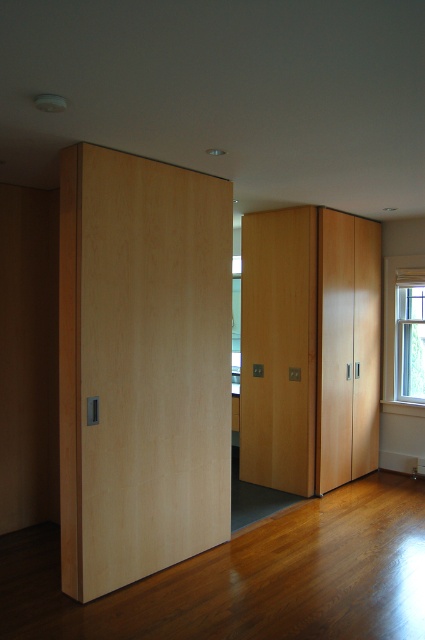
You are moving a 30 inch wide painting and want to hang it between the matte wood cabinet at center and the clear glass window at right. Is there enough space?

The distance between the matte wood cabinet at center and the clear glass window at right is 28.36 inches. Since the painting is 30 inches wide, it will not fit in the available space.